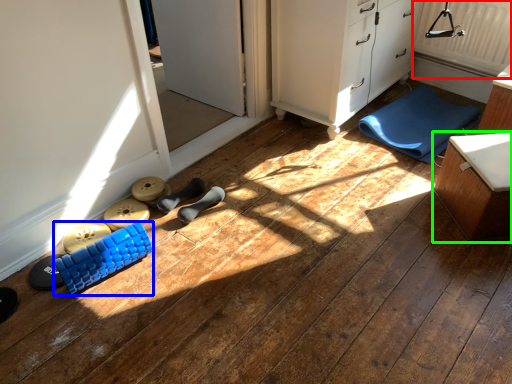
Question: Which object is the closest to the radiator (highlighted by a red box)? Choose among these: toy (highlighted by a blue box) or furniture (highlighted by a green box).

Choices:
 (A) toy
 (B) furniture

Answer: (B)